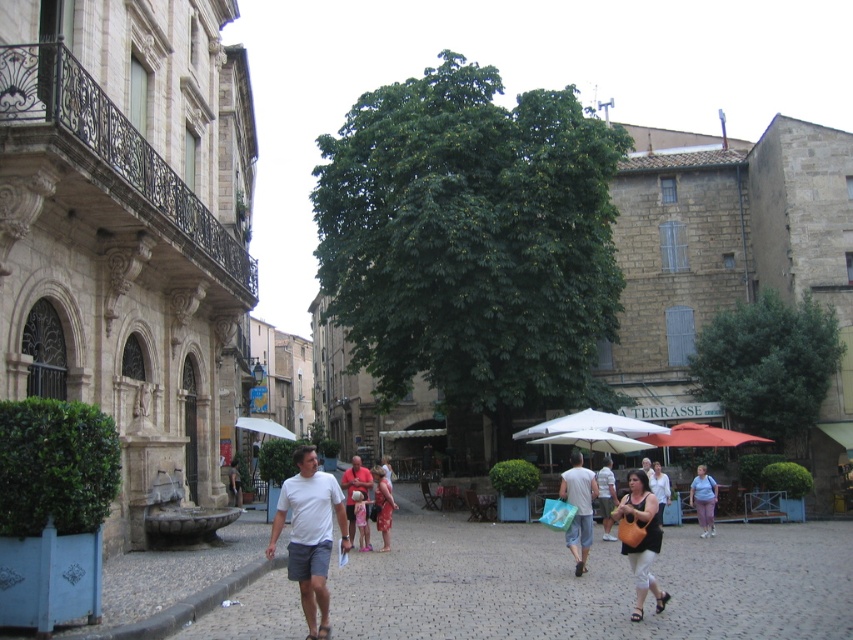
Is white fabric umbrella at center above light purple fabric dress at center?

Indeed, white fabric umbrella at center is positioned over light purple fabric dress at center.

Which is behind, point (602, 412) or point (691, 502)?

Positioned behind is point (602, 412).

The width and height of the screenshot is (853, 640). What are the coordinates of `white fabric umbrella at center` in the screenshot? It's located at (593, 432).

Does point (305, 532) come behind point (601, 506)?

No, (305, 532) is in front of (601, 506).

Which of these two, white cotton t-shirt at center or light brown fabric shirt at center, stands taller?

white cotton t-shirt at center is taller.

Identify the location of white cotton t-shirt at center. This screenshot has width=853, height=640. (309, 534).

The height and width of the screenshot is (640, 853). I want to click on white cotton t-shirt at center, so [309, 534].

Is white cotton shirt at center thinner than light brown leather jacket at center?

In fact, white cotton shirt at center might be wider than light brown leather jacket at center.

Can you confirm if white cotton shirt at center is positioned to the left of light brown leather jacket at center?

No, white cotton shirt at center is not to the left of light brown leather jacket at center.

Locate an element on the screen. white cotton shirt at center is located at coordinates point(659,486).

Where is `white cotton shirt at center`? This screenshot has height=640, width=853. white cotton shirt at center is located at coordinates coord(659,486).